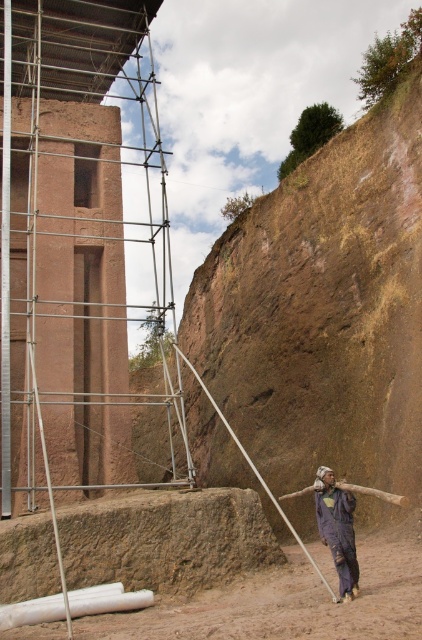
Question: From the image, what is the correct spatial relationship of brown dirt field at lower right in relation to dark blue fabric at lower center?

Choices:
 (A) below
 (B) above

Answer: (A)

Question: Considering the relative positions of brown dirt field at lower right and dark blue fabric at lower center in the image provided, where is brown dirt field at lower right located with respect to dark blue fabric at lower center?

Choices:
 (A) right
 (B) left

Answer: (B)

Question: Which object appears closest to the camera in this image?

Choices:
 (A) brown dirt field at lower right
 (B) dark blue fabric at lower center

Answer: (A)

Question: Which point is closer to the camera?

Choices:
 (A) dark blue fabric at lower center
 (B) brown dirt field at lower right

Answer: (B)

Question: Which point is closer to the camera?

Choices:
 (A) dark blue fabric at lower center
 (B) brown dirt field at lower right

Answer: (B)

Question: Is brown dirt field at lower right below dark blue fabric at lower center?

Choices:
 (A) no
 (B) yes

Answer: (B)